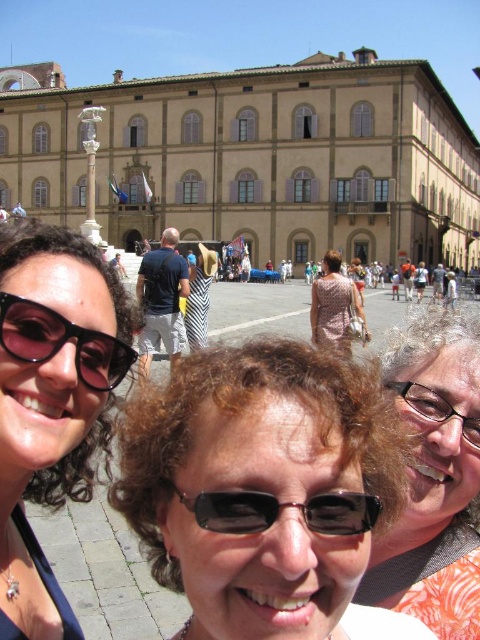
Question: Can you confirm if brown hair at center is positioned to the right of striped fabric at center?

Choices:
 (A) yes
 (B) no

Answer: (A)

Question: Which point appears farthest from the camera in this image?

Choices:
 (A) (45, 337)
 (B) (336, 276)
 (C) (262, 548)
 (D) (204, 312)

Answer: (B)

Question: Does brown hair at center have a lesser width compared to pink reflective sunglasses at upper left?

Choices:
 (A) no
 (B) yes

Answer: (A)

Question: Does smooth stone pavement at center appear over curly hair at center?

Choices:
 (A) yes
 (B) no

Answer: (A)

Question: Which point is closer to the camera taking this photo?

Choices:
 (A) (272, 388)
 (B) (432, 374)
 (C) (101, 333)
 (D) (203, 340)

Answer: (A)

Question: Which of the following is the farthest from the observer?

Choices:
 (A) (364, 531)
 (B) (333, 339)

Answer: (B)